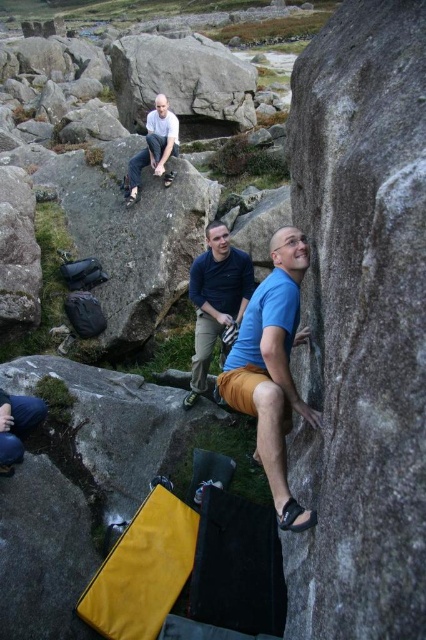
From the picture: Who is shorter, gray rough rock at right or blue matte shirt at center?

With less height is blue matte shirt at center.

Can you confirm if gray rough rock at right is smaller than blue matte shirt at center?

No.

Locate an element on the screen. Image resolution: width=426 pixels, height=640 pixels. gray rough rock at right is located at coordinates (360, 324).

Is point (259, 292) positioned behind point (146, 125)?

No, it is in front of (146, 125).

Can you confirm if blue matte shirt at center is positioned to the left of white matte shirt at upper center?

In fact, blue matte shirt at center is to the right of white matte shirt at upper center.

Between point (293, 525) and point (160, 120), which one is positioned behind?

Positioned behind is point (160, 120).

This screenshot has width=426, height=640. What are the coordinates of `blue matte shirt at center` in the screenshot? It's located at (271, 369).

Is blue matte shirt at center positioned at the back of blue fabric pants at center?

No, it is not.

Does blue matte shirt at center appear under blue fabric pants at center?

Yes, blue matte shirt at center is below blue fabric pants at center.

Between point (282, 454) and point (207, 250), which one is positioned in front?

Point (282, 454)

At what (x,y) coordinates should I click in order to perform the action: click on blue matte shirt at center. Please return your answer as a coordinate pair (x, y). Looking at the image, I should click on (271, 369).